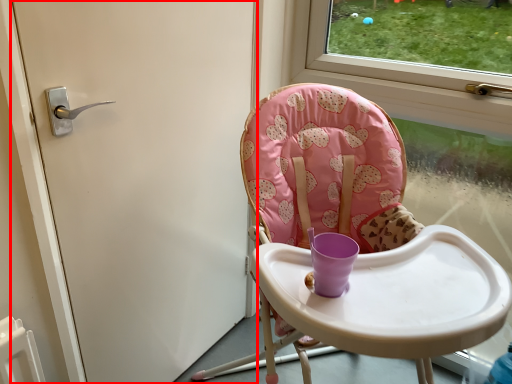
Question: Where is door (annotated by the red box) located in relation to chair in the image?

Choices:
 (A) right
 (B) left

Answer: (B)